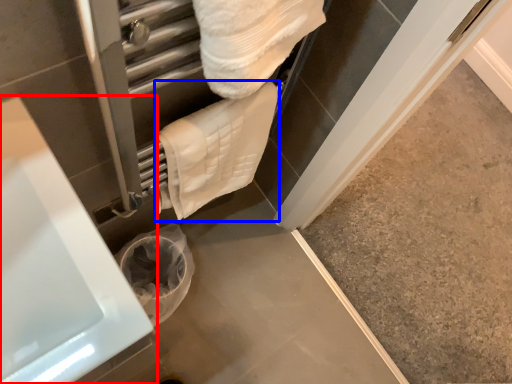
Question: Among these objects, which one is nearest to the camera, bath (highlighted by a red box) or towel (highlighted by a blue box)?

Choices:
 (A) bath
 (B) towel

Answer: (A)